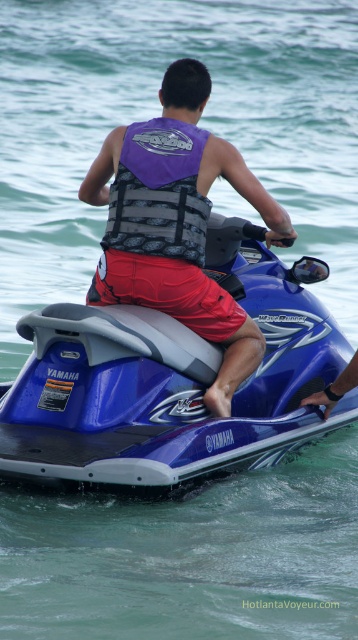
Does blue metallic jet ski at center have a lesser width compared to purple fabric life vest at center?

No, blue metallic jet ski at center is not thinner than purple fabric life vest at center.

Who is positioned more to the right, blue metallic jet ski at center or purple fabric life vest at center?

blue metallic jet ski at center

Between point (186, 362) and point (190, 122), which one is positioned behind?

The point (190, 122) is more distant.

Locate an element on the screen. blue metallic jet ski at center is located at coordinates (171, 380).

Who is more forward, (11, 474) or (187, 234)?

Point (11, 474) is in front.

Find the location of `blue metallic jet ski at center`. blue metallic jet ski at center is located at coordinates (171, 380).

Is point (147, 147) closer to camera compared to point (166, 184)?

No, (147, 147) is further to viewer.

Does purple fabric life vest at center have a larger size compared to purple fabric life jacket at center?

Indeed, purple fabric life vest at center has a larger size compared to purple fabric life jacket at center.

I want to click on purple fabric life vest at center, so click(176, 224).

The height and width of the screenshot is (640, 358). I want to click on purple fabric life vest at center, so click(x=176, y=224).